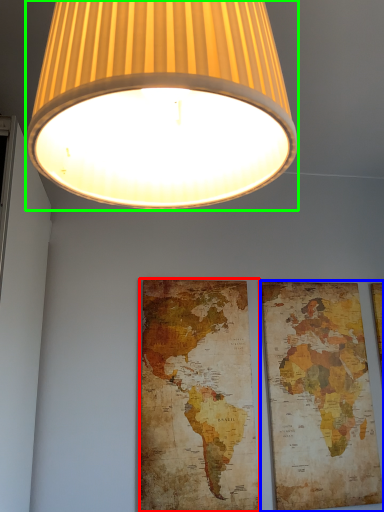
Question: Based on their relative distances, which object is nearer to map (highlighted by a red box)? Choose from picture frame (highlighted by a blue box) and lamp (highlighted by a green box).

Choices:
 (A) picture frame
 (B) lamp

Answer: (A)